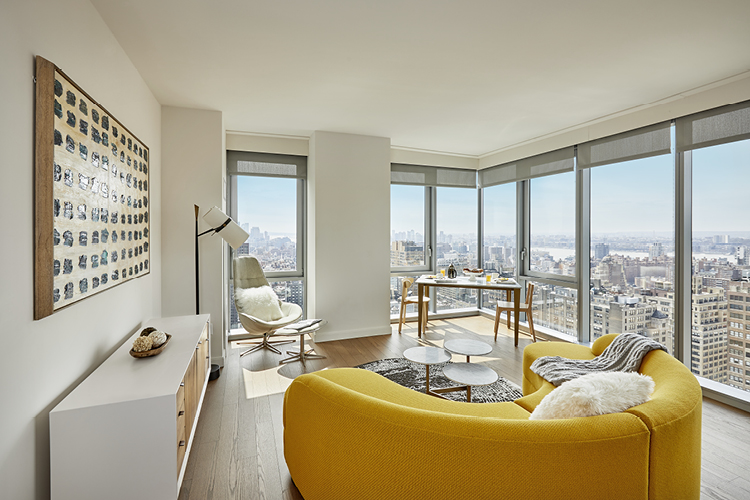
Where is `coffeetable`? This screenshot has width=750, height=500. coffeetable is located at coordinates (474, 376), (477, 345), (430, 359).